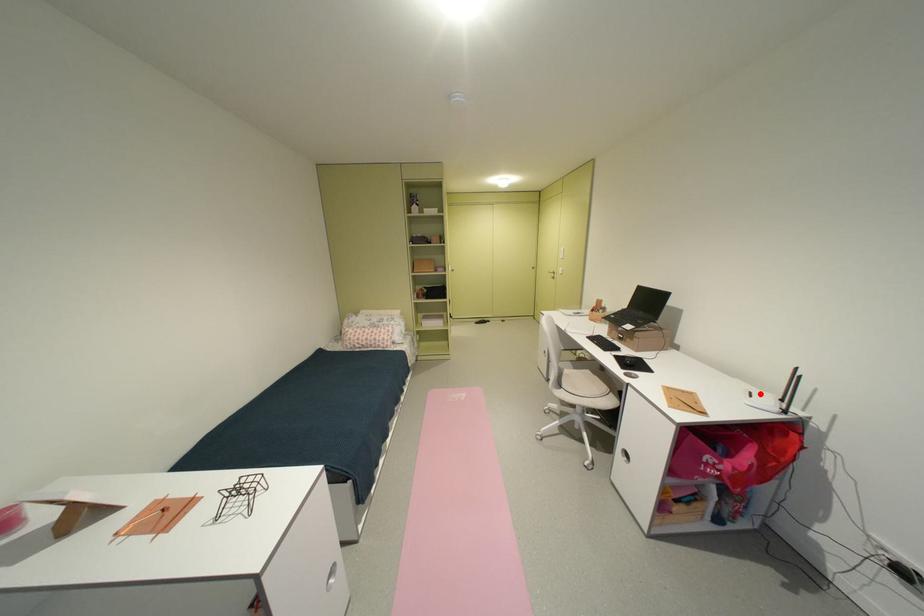
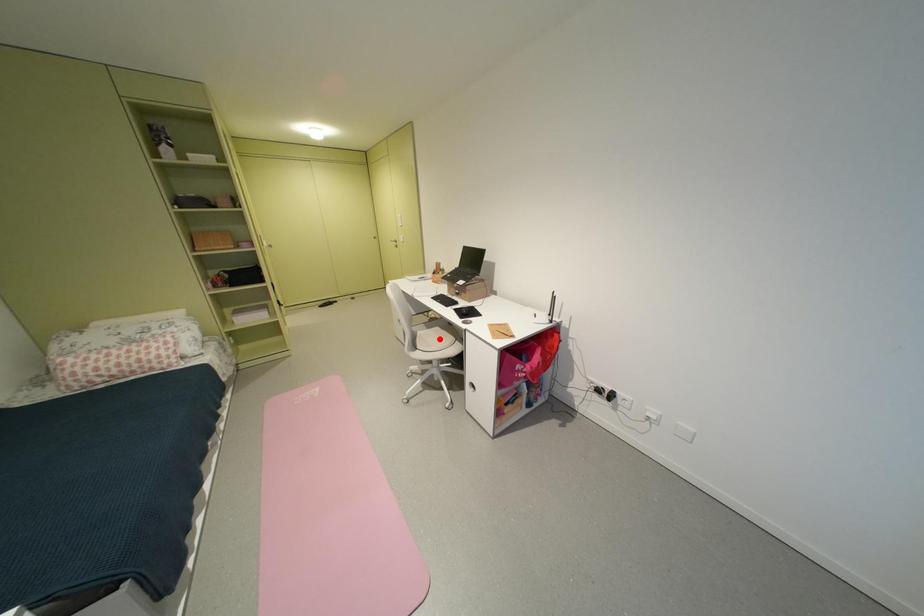
I am providing you with two images of the same scene from different viewpoints. A red point is marked on the first image and another point is marked on the second image. Does the point marked in image1 correspond to the same location as the one in image2?

No